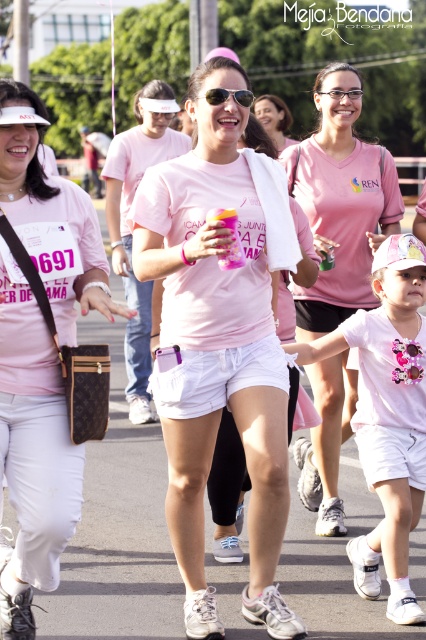
You are a photographer at the charity event. You want to take a photo focusing on the central woman with the pink shirt and the young girl in the Minnie Mouse outfit. The camera is set to focus on the point at point (250, 228). Will the young girl holding hands with the central woman, located at point (282, 131), also be in focus?

Point (250, 228) is closer to the camera than point (282, 131). Since the camera focuses on the closer point, the central woman will be in focus, but the young girl at point (282, 131) may be slightly out of focus depending on the depth of field.

Looking at this image, what is located at the coordinates point (216,349) in the image?

The point (216,349) is where the matte pink t shirt at center is located.

You are a photographer at the charity event and want to capture a photo that includes both the point at location (123,221) and the point at (232,92). Which point should you position closer to the camera to ensure both are in focus?

To ensure both points are in focus, position the point at (232,92) closer to the camera since it is in front of the point at (123,221).